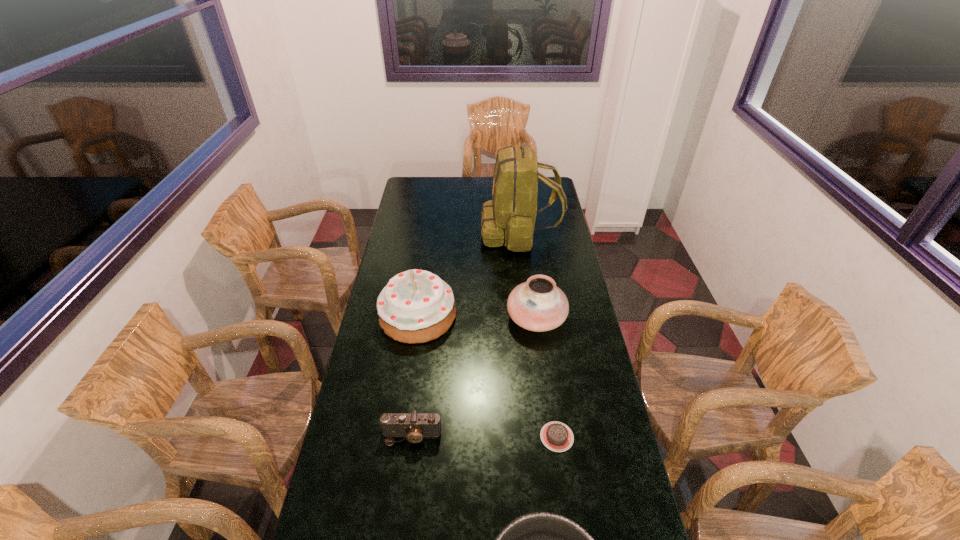
At what (x,y) coordinates should I click in order to perform the action: click on vacant region at the right edge. Please return your answer as a coordinate pair (x, y). The width and height of the screenshot is (960, 540). Looking at the image, I should click on (540, 275).

At what (x,y) coordinates should I click in order to perform the action: click on vacant space at the far right corner. Please return your answer as a coordinate pair (x, y). Image resolution: width=960 pixels, height=540 pixels. Looking at the image, I should click on (550, 190).

At what (x,y) coordinates should I click in order to perform the action: click on unoccupied position between the pottery and the camera. Please return your answer as a coordinate pair (x, y). Looking at the image, I should click on (474, 377).

In order to click on empty space that is in between the pottery and the camera in this screenshot , I will do `click(474, 377)`.

The height and width of the screenshot is (540, 960). Find the location of `vacant space that is in between the pottery and the chocolate cake`. vacant space that is in between the pottery and the chocolate cake is located at coordinates (546, 377).

This screenshot has height=540, width=960. In order to click on empty space that is in between the cake and the camera in this screenshot , I will do `click(415, 376)`.

I want to click on vacant space that's between the pottery and the tallest object, so click(x=528, y=275).

Image resolution: width=960 pixels, height=540 pixels. In order to click on the second closest object to the nearest object in this screenshot , I will do `click(414, 426)`.

I want to click on the fourth closest object relative to the frying pan, so click(x=538, y=305).

The height and width of the screenshot is (540, 960). Identify the location of blank area in the image that satisfies the following two spatial constraints: 1. on the front-facing side of the tallest object; 2. on the right side of the pottery. (530, 318).